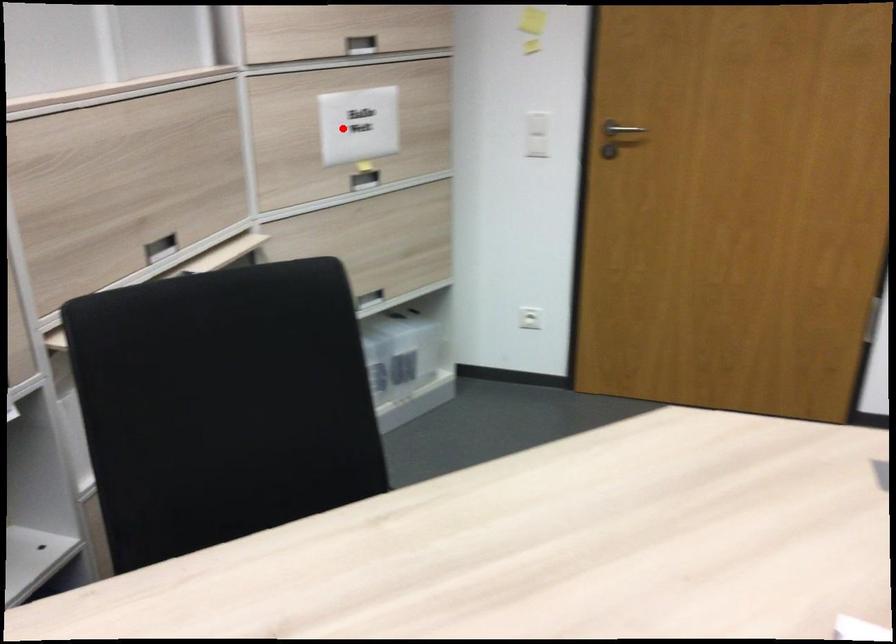
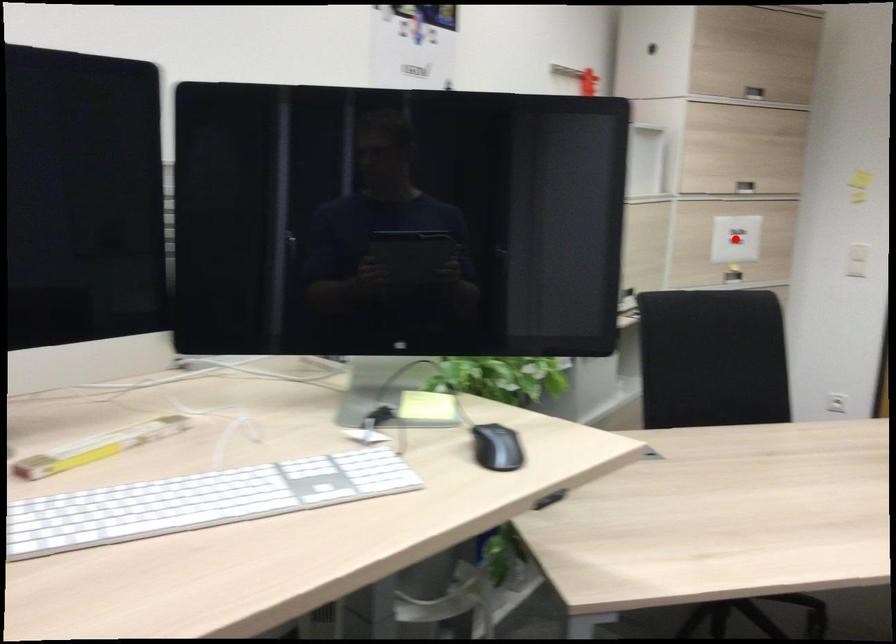
I am providing you with two images of the same scene from different viewpoints. A red point is marked on the first image and another point is marked on the second image. Is the marked point in image1 the same physical position as the marked point in image2?

Yes